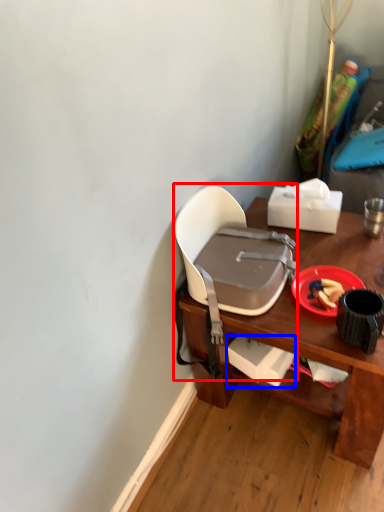
Question: Which of the following is the closest to the observer, chair (highlighted by a red box) or box (highlighted by a blue box)?

Choices:
 (A) chair
 (B) box

Answer: (A)